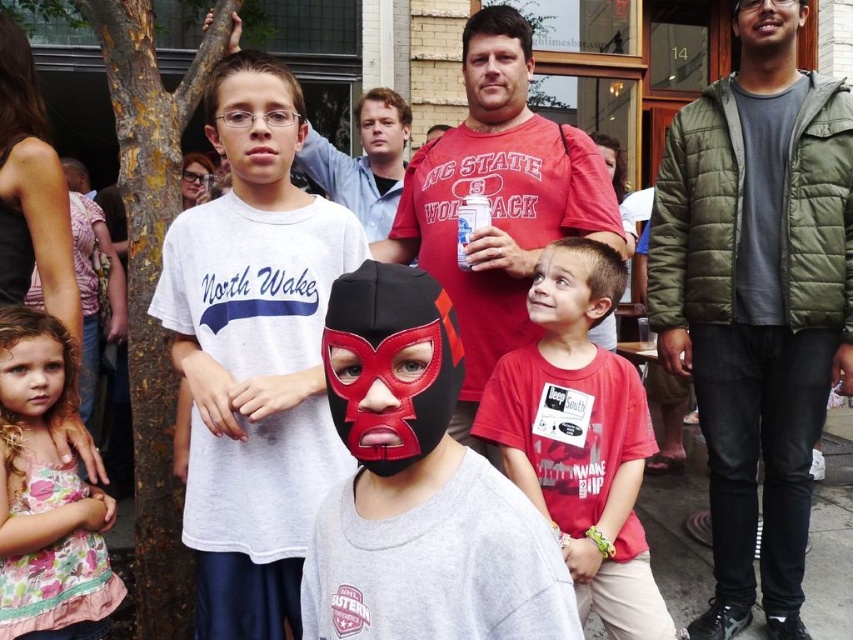
You are standing in the outdoor scene and want to determine which of the two points, point (439, 541) or point (500, 371), is closer to you. Based on the image, which point is nearer?

Point (439, 541) is closer to the viewer than point (500, 371).